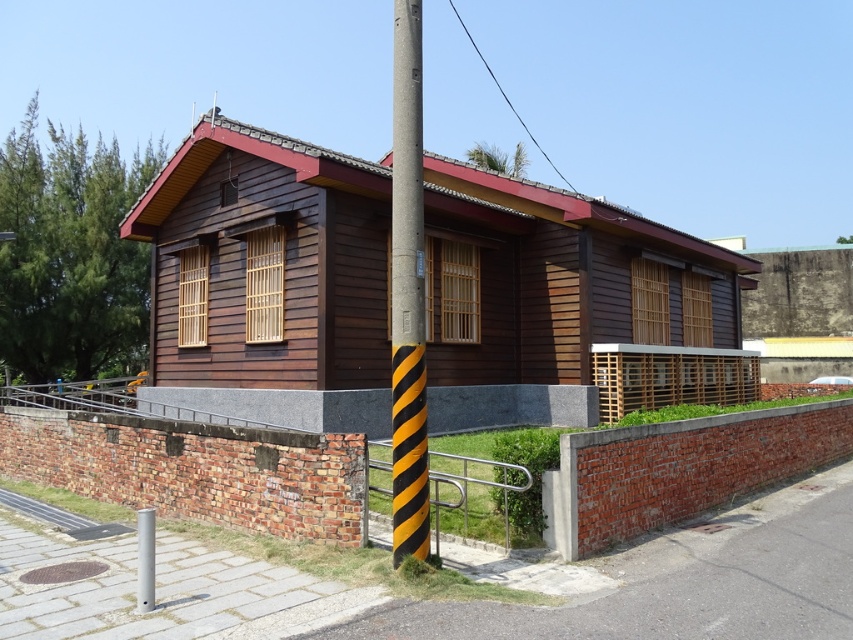
Can you confirm if yellow-black striped pole at center is wider than white plastic street sign at upper center?

In fact, yellow-black striped pole at center might be narrower than white plastic street sign at upper center.

Who is taller, yellow-black striped pole at center or white plastic street sign at upper center?

Standing taller between the two is yellow-black striped pole at center.

The width and height of the screenshot is (853, 640). What do you see at coordinates (407, 292) in the screenshot?
I see `yellow-black striped pole at center` at bounding box center [407, 292].

At what (x,y) coordinates should I click in order to perform the action: click on yellow-black striped pole at center. Please return your answer as a coordinate pair (x, y). Looking at the image, I should click on (407, 292).